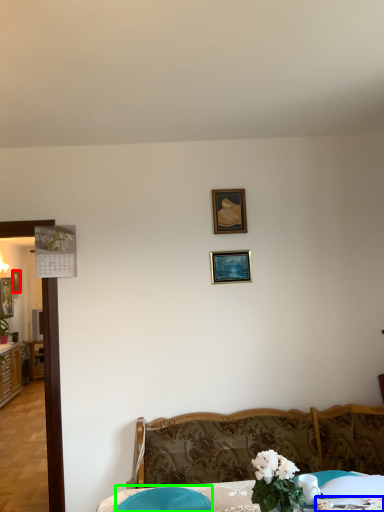
Question: Considering the real-world distances, which object is farthest from picture frame (highlighted by a red box)? tablecloth (highlighted by a blue box) or swivel chair (highlighted by a green box)?

Choices:
 (A) tablecloth
 (B) swivel chair

Answer: (A)